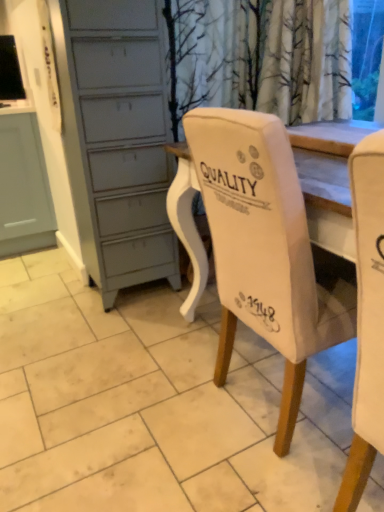
At what (x,y) coordinates should I click in order to perform the action: click on vacant space that is to the left of white fabric chair at center. Please return your answer as a coordinate pair (x, y). Looking at the image, I should click on click(143, 401).